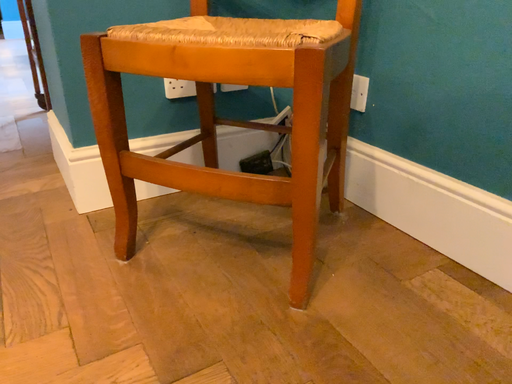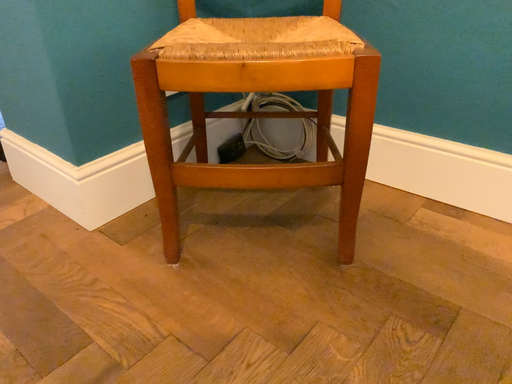
Question: How did the camera likely rotate when shooting the video?

Choices:
 (A) rotated left
 (B) rotated right

Answer: (B)